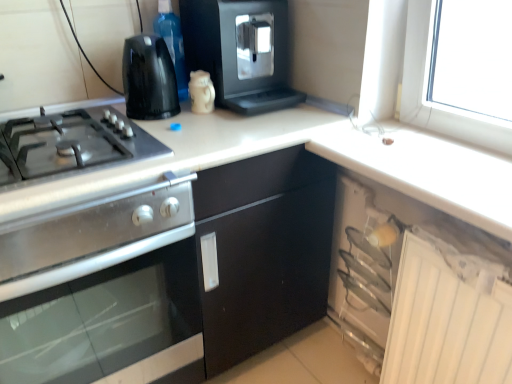
Where is `vacant point above white plastic cabinet at lower right (from a real-world perspective)`? vacant point above white plastic cabinet at lower right (from a real-world perspective) is located at coordinates click(449, 241).